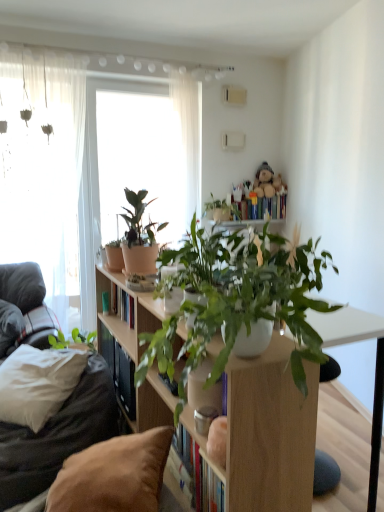
Question: Are brown fabric couch at left and translucent fabric at left, which is the second window from right to left, making contact?

Choices:
 (A) no
 (B) yes

Answer: (A)

Question: Considering the relative sizes of brown fabric couch at left and translucent fabric at left, which is the second window from right to left, in the image provided, is brown fabric couch at left thinner than translucent fabric at left, which is the second window from right to left,?

Choices:
 (A) yes
 (B) no

Answer: (B)

Question: Is brown fabric couch at left taller than translucent fabric at left, which is the second window from right to left?

Choices:
 (A) no
 (B) yes

Answer: (A)

Question: Can you confirm if brown fabric couch at left is smaller than translucent fabric at left, the 1th window in the left-to-right sequence?

Choices:
 (A) yes
 (B) no

Answer: (A)

Question: Is brown fabric couch at left at the right side of translucent fabric at left, the 1th window in the left-to-right sequence?

Choices:
 (A) no
 (B) yes

Answer: (B)

Question: Can translucent fabric at left, the 1th window in the left-to-right sequence, be found inside brown fabric couch at left?

Choices:
 (A) yes
 (B) no

Answer: (B)

Question: Is translucent fabric at left, the 1th window in the left-to-right sequence, smaller than white matte bookcase at center?

Choices:
 (A) yes
 (B) no

Answer: (B)

Question: Can you confirm if translucent fabric at left, which is the second window from right to left, is bigger than white matte bookcase at center?

Choices:
 (A) yes
 (B) no

Answer: (A)

Question: Is white matte bookcase at center at the back of translucent fabric at left, the 1th window in the left-to-right sequence?

Choices:
 (A) no
 (B) yes

Answer: (A)

Question: Considering the relative sizes of translucent fabric at left, which is the second window from right to left, and white matte bookcase at center in the image provided, is translucent fabric at left, which is the second window from right to left, wider than white matte bookcase at center?

Choices:
 (A) yes
 (B) no

Answer: (B)

Question: From the image's perspective, does translucent fabric at left, the 1th window in the left-to-right sequence, appear lower than white matte bookcase at center?

Choices:
 (A) yes
 (B) no

Answer: (B)

Question: Considering the relative sizes of translucent fabric at left, which is the second window from right to left, and white matte bookcase at center in the image provided, is translucent fabric at left, which is the second window from right to left, shorter than white matte bookcase at center?

Choices:
 (A) no
 (B) yes

Answer: (A)

Question: Is translucent fabric at left, the 1th window in the left-to-right sequence, positioned in front of brown fabric pillow at lower left, arranged as the 2th pillow when viewed from the back?

Choices:
 (A) yes
 (B) no

Answer: (B)